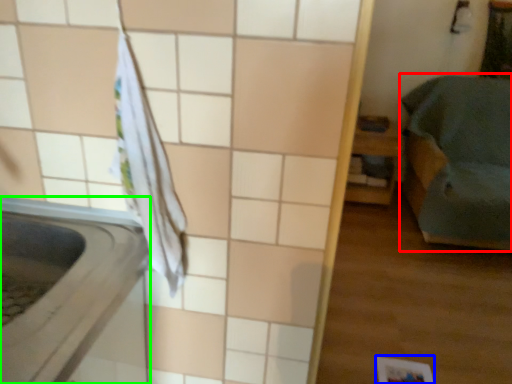
Question: Which is farther away from furniture (highlighted by a red box)? square (highlighted by a blue box) or appliance (highlighted by a green box)?

Choices:
 (A) square
 (B) appliance

Answer: (B)